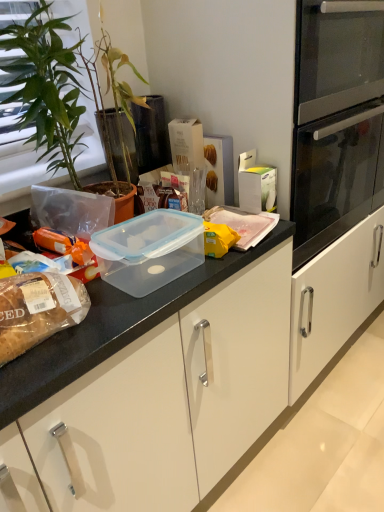
Where is `free space above translucent plastic container at center, which is the second food from front to back (from a real-world perspective)`? free space above translucent plastic container at center, which is the second food from front to back (from a real-world perspective) is located at coordinates (219, 216).